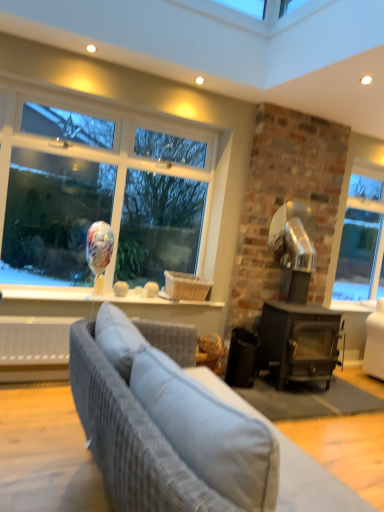
Question: Is textured gray fabric couch at lower left touching dark gray wood stove at right?

Choices:
 (A) yes
 (B) no

Answer: (B)

Question: Is textured gray fabric couch at lower left further to camera compared to dark gray wood stove at right?

Choices:
 (A) no
 (B) yes

Answer: (A)

Question: Is textured gray fabric couch at lower left located outside dark gray wood stove at right?

Choices:
 (A) yes
 (B) no

Answer: (A)

Question: Could you tell me if textured gray fabric couch at lower left is facing dark gray wood stove at right?

Choices:
 (A) no
 (B) yes

Answer: (A)

Question: Is dark gray wood stove at right surrounded by textured gray fabric couch at lower left?

Choices:
 (A) yes
 (B) no

Answer: (B)

Question: Can you confirm if textured gray fabric couch at lower left is taller than dark gray wood stove at right?

Choices:
 (A) no
 (B) yes

Answer: (A)

Question: Does dark gray wood stove at right have a greater height compared to textured gray fabric couch at lower left?

Choices:
 (A) no
 (B) yes

Answer: (B)

Question: Is dark gray wood stove at right bigger than textured gray fabric couch at lower left?

Choices:
 (A) yes
 (B) no

Answer: (A)

Question: Is dark gray wood stove at right turned away from textured gray fabric couch at lower left?

Choices:
 (A) yes
 (B) no

Answer: (B)

Question: Is dark gray wood stove at right closer to the viewer compared to textured gray fabric couch at lower left?

Choices:
 (A) yes
 (B) no

Answer: (B)

Question: Are dark gray wood stove at right and textured gray fabric couch at lower left beside each other?

Choices:
 (A) no
 (B) yes

Answer: (A)

Question: Considering the relative sizes of dark gray wood stove at right and textured gray fabric couch at lower left in the image provided, is dark gray wood stove at right shorter than textured gray fabric couch at lower left?

Choices:
 (A) no
 (B) yes

Answer: (A)

Question: From a real-world perspective, relative to dark gray wood stove at right, is textured gray fabric couch at lower left vertically above or below?

Choices:
 (A) above
 (B) below

Answer: (B)